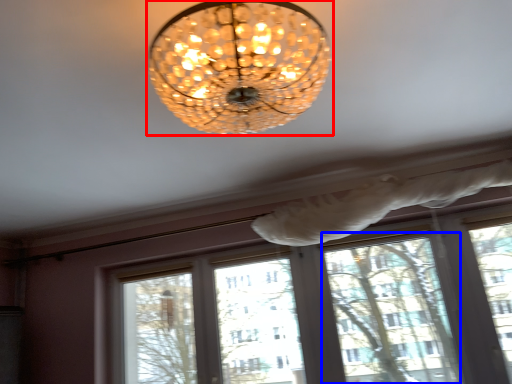
Question: Which object is closer to the camera taking this photo, lamp (highlighted by a red box) or window frame (highlighted by a blue box)?

Choices:
 (A) lamp
 (B) window frame

Answer: (A)